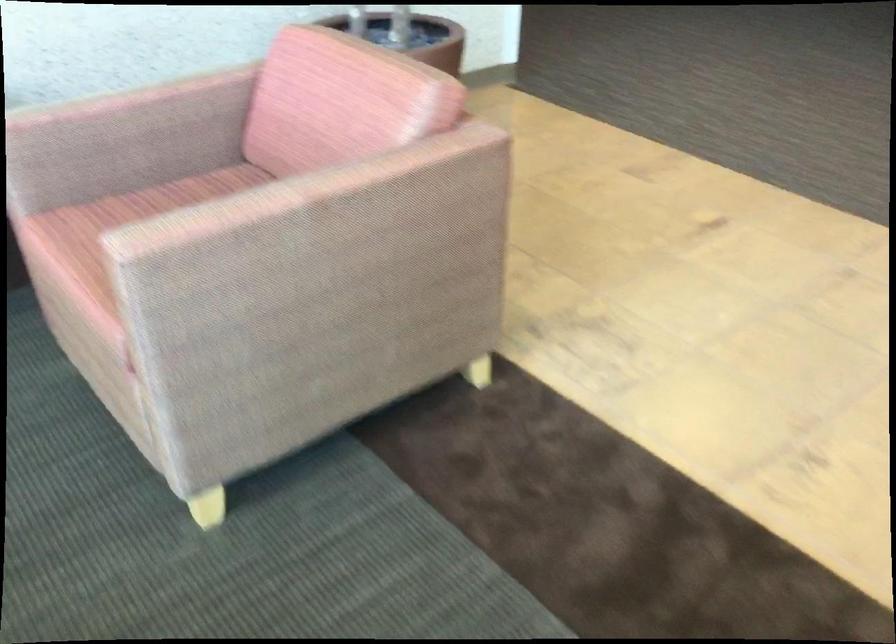
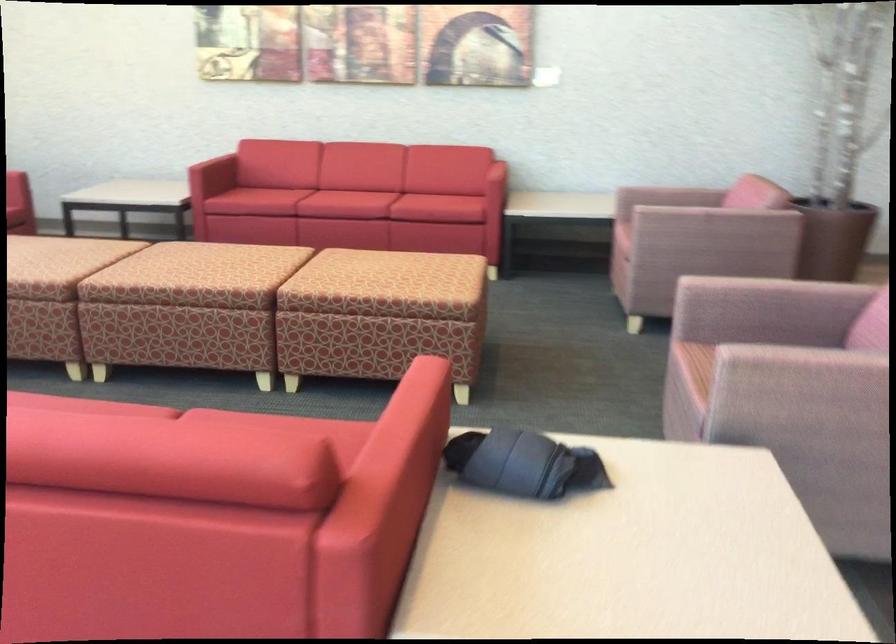
Find the pixel in the second image that matches (156,162) in the first image.

(669, 196)